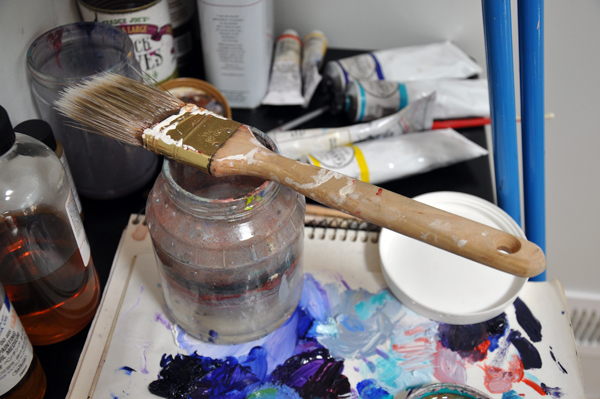
The width and height of the screenshot is (600, 399). What are the coordinates of `handle` in the screenshot? It's located at (440, 219).